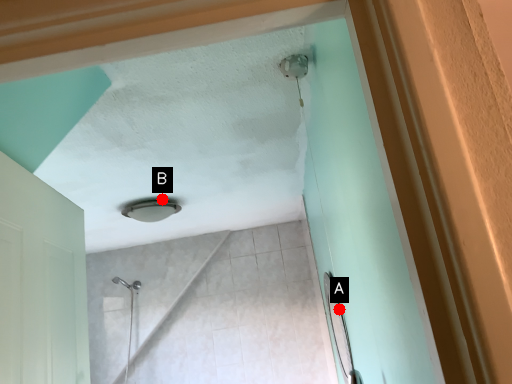
Question: Two points are circled on the image, labeled by A and B beside each circle. Which point is farther to the camera?

Choices:
 (A) A is further
 (B) B is further

Answer: (B)